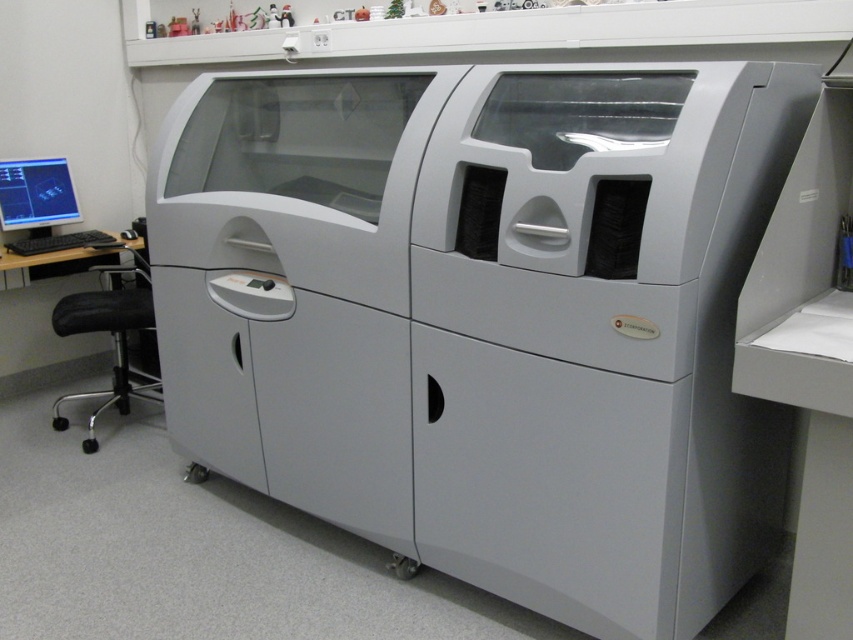
Which is below, black plastic computer desk at lower left or matte black monitor at left?

black plastic computer desk at lower left is lower down.

Is point (86, 368) farther from camera compared to point (99, 243)?

Yes, point (86, 368) is farther from viewer.

Locate an element on the screen. Image resolution: width=853 pixels, height=640 pixels. black plastic computer desk at lower left is located at coordinates (45, 321).

At what (x,y) coordinates should I click in order to perform the action: click on black plastic computer desk at lower left. Please return your answer as a coordinate pair (x, y). The width and height of the screenshot is (853, 640). Looking at the image, I should click on (45, 321).

Who is shorter, matte gray printer at center or black plastic computer desk at lower left?

With less height is black plastic computer desk at lower left.

In the scene shown: Can you confirm if matte gray printer at center is wider than black plastic computer desk at lower left?

Indeed, matte gray printer at center has a greater width compared to black plastic computer desk at lower left.

Which is in front, point (334, 520) or point (3, 260)?

Point (334, 520)

In order to click on matte gray printer at center in this screenshot , I will do `click(486, 317)`.

The width and height of the screenshot is (853, 640). Describe the element at coordinates (486, 317) in the screenshot. I see `matte gray printer at center` at that location.

Identify the location of matte gray printer at center. The height and width of the screenshot is (640, 853). (486, 317).

Which is behind, point (635, 177) or point (36, 236)?

Point (36, 236)

What are the coordinates of `matte gray printer at center` in the screenshot? It's located at (486, 317).